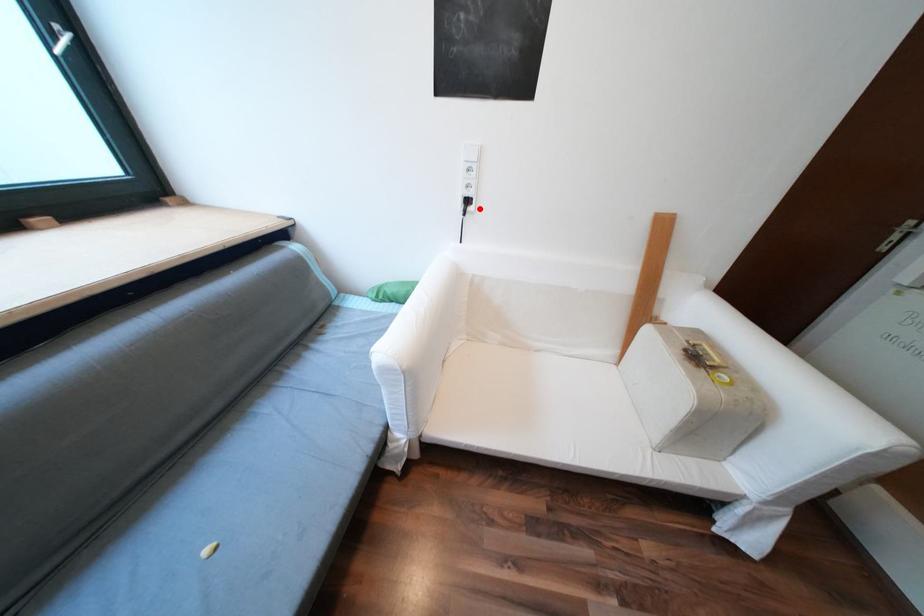
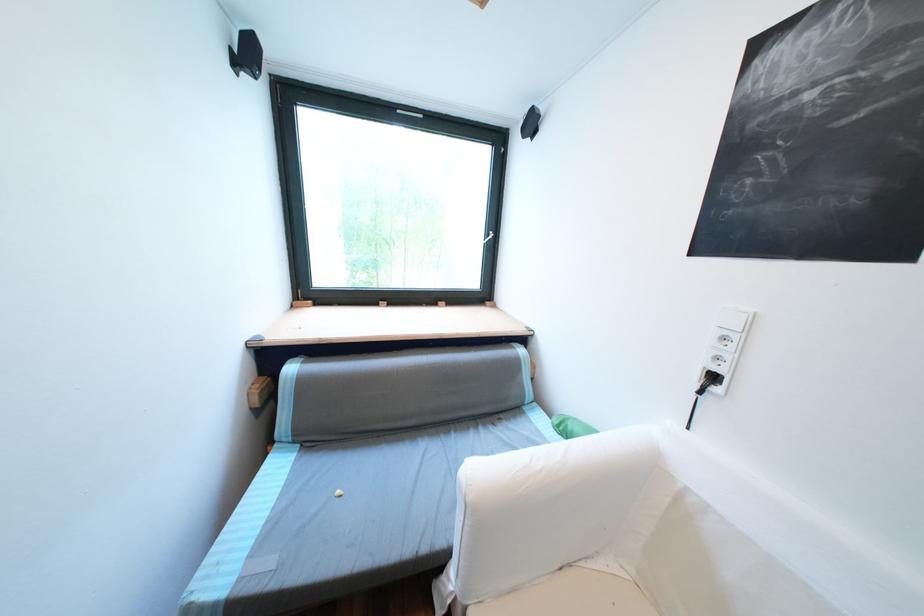
Question: I am providing you with two images of the same scene from different viewpoints. A red point is marked on the first image. At the location where the point appears in image 1, is it still visible in image 2?

Choices:
 (A) Yes
 (B) No

Answer: (A)